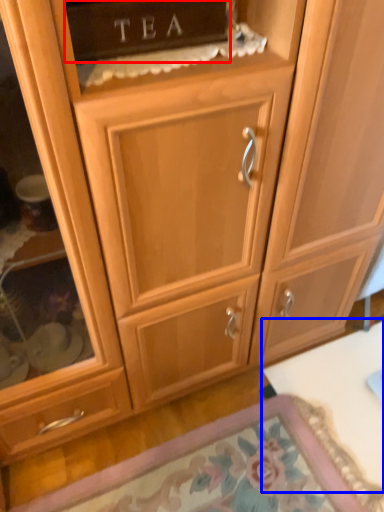
Question: Which object appears farthest to the camera in this image, cabinetry (highlighted by a red box) or table (highlighted by a blue box)?

Choices:
 (A) cabinetry
 (B) table

Answer: (B)